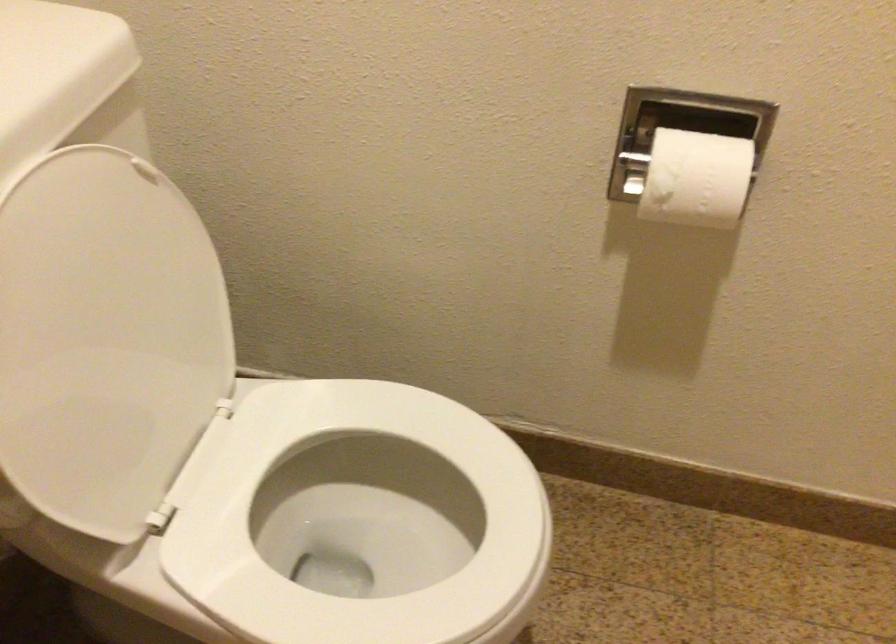
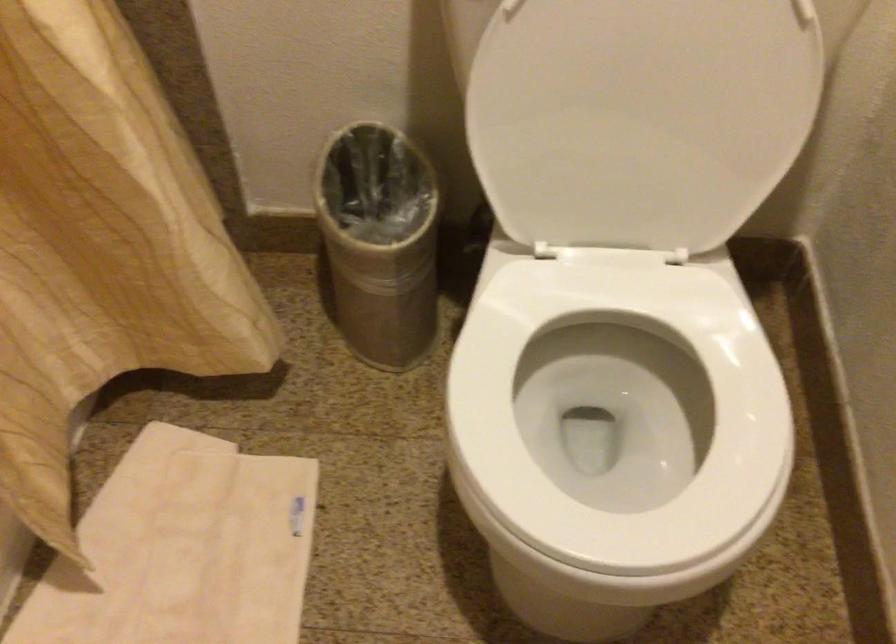
Based on the continuous images, in which direction is the camera rotating?

The camera rotated toward left-down.